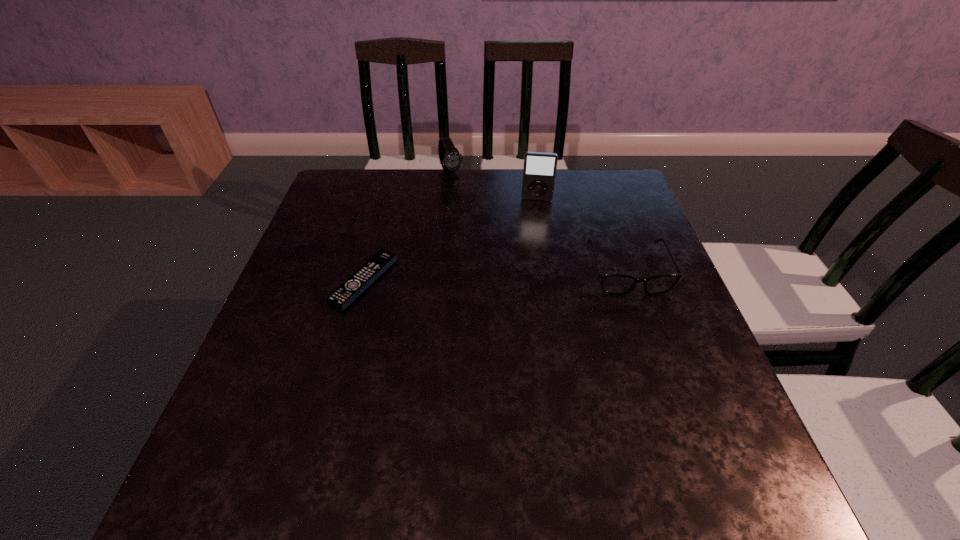
This screenshot has height=540, width=960. Find the location of `free location located 0.060m on the front-facing side of the second farthest object`. free location located 0.060m on the front-facing side of the second farthest object is located at coordinates (535, 214).

Identify the location of free space located on the front-facing side of the second farthest object. This screenshot has height=540, width=960. (534, 225).

Where is `vacant space located on the front-facing side of the second farthest object`? vacant space located on the front-facing side of the second farthest object is located at coordinates (530, 281).

You are a GUI agent. You are given a task and a screenshot of the screen. Output one action in this format:
    pyautogui.click(x=<x>, y=<y>)
    Task: Click on the vacant region located on the face of the farthest object
    The image size is (960, 540).
    Given the screenshot: What is the action you would take?
    [467, 201]

Find the location of a particular element. The image size is (960, 540). vacant space positioned on the face of the farthest object is located at coordinates (489, 231).

Locate an element on the screen. The image size is (960, 540). free space located on the face of the farthest object is located at coordinates (478, 216).

Image resolution: width=960 pixels, height=540 pixels. I want to click on iPod that is at the far edge, so click(539, 172).

Where is `watch that is at the far edge`? watch that is at the far edge is located at coordinates (450, 159).

Locate an element on the screen. This screenshot has height=540, width=960. object located at the left edge is located at coordinates (347, 292).

I want to click on object located in the right edge section of the desktop, so click(x=618, y=284).